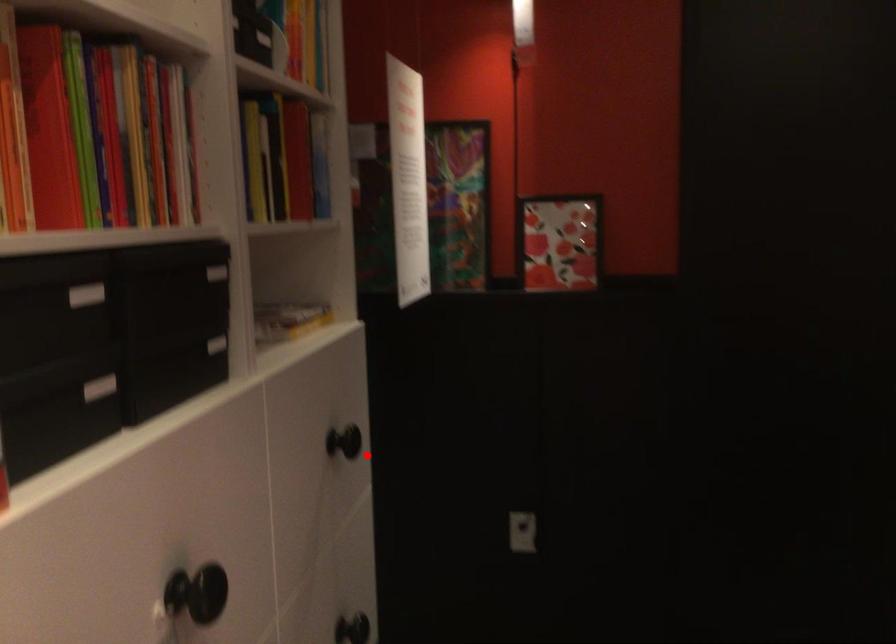
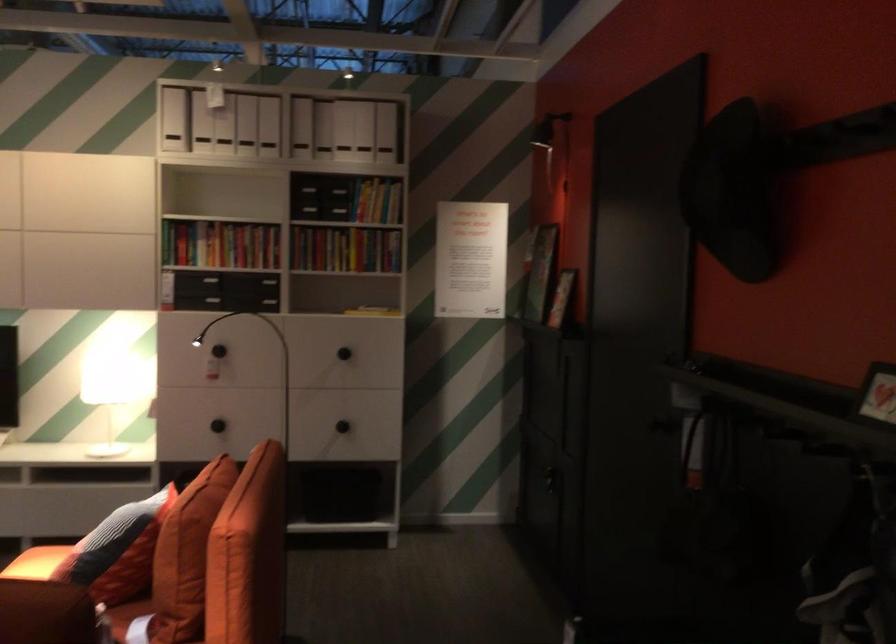
Locate, in the second image, the point that corresponds to the highlighted location in the first image.

(343, 353)